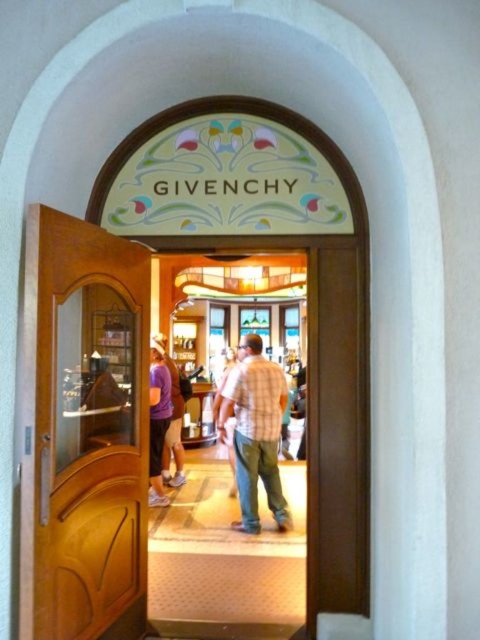
Question: Can you confirm if plaid shirt at center is positioned to the right of purple fabric pants at center?

Choices:
 (A) yes
 (B) no

Answer: (A)

Question: Does wooden door at left appear over purple fabric pants at center?

Choices:
 (A) yes
 (B) no

Answer: (A)

Question: Which of the following is the closest to the observer?

Choices:
 (A) (155, 497)
 (B) (278, 484)

Answer: (B)

Question: Estimate the real-world distances between objects in this image. Which object is farther from the wooden door at left?

Choices:
 (A) purple fabric pants at center
 (B) plaid shirt at center

Answer: (A)

Question: Is plaid shirt at center to the right of purple fabric pants at center from the viewer's perspective?

Choices:
 (A) yes
 (B) no

Answer: (A)

Question: Which object is positioned closest to the wooden door at left?

Choices:
 (A) purple fabric pants at center
 (B) plaid shirt at center

Answer: (B)